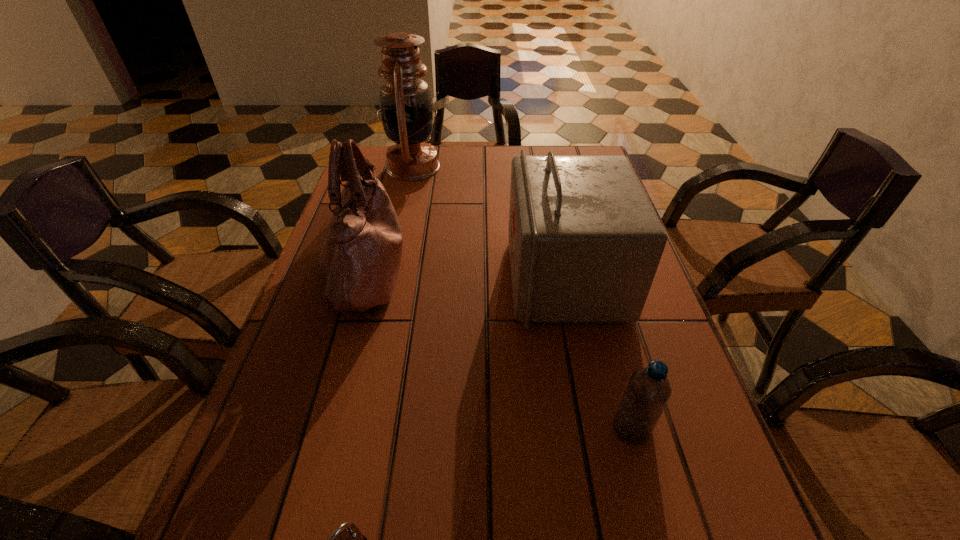
You are a GUI agent. You are given a task and a screenshot of the screen. Output one action in this format:
    pyautogui.click(x=<x>, y=<y>)
    Task: Click on the farthest object
    The image size is (960, 540).
    Given the screenshot: What is the action you would take?
    pyautogui.click(x=406, y=109)

Where is `the tallest object`? Image resolution: width=960 pixels, height=540 pixels. the tallest object is located at coordinates (406, 109).

Where is `handbag`? handbag is located at coordinates [360, 258].

This screenshot has width=960, height=540. In order to click on the first-aid kit in this screenshot , I will do `click(585, 242)`.

In order to click on water bottle in this screenshot , I will do `click(648, 390)`.

I want to click on the fourth farthest object, so click(x=648, y=390).

Find the location of `vacant space located 0.290m on the front of the oil lamp`. vacant space located 0.290m on the front of the oil lamp is located at coordinates (395, 248).

This screenshot has width=960, height=540. I want to click on vacant space located at the front of the handbag with handles, so click(x=468, y=271).

At what (x,y) coordinates should I click in order to perform the action: click on free space located on the front-facing side of the first-aid kit. Please return your answer as a coordinate pair (x, y). The height and width of the screenshot is (540, 960). Looking at the image, I should click on (338, 278).

Locate an element on the screen. Image resolution: width=960 pixels, height=540 pixels. vacant area situated 0.300m on the front-facing side of the first-aid kit is located at coordinates 381,278.